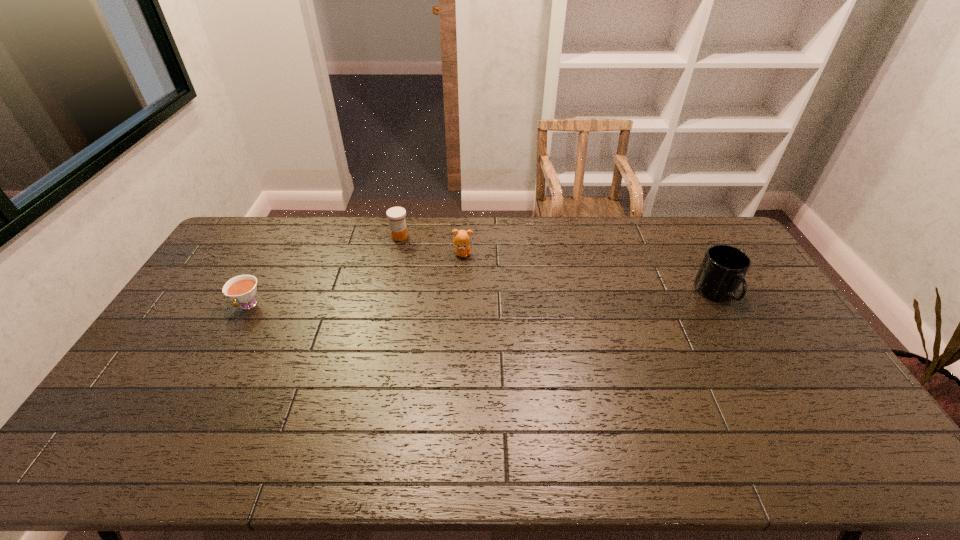
Find the location of `free space at the far edge of the desktop`. free space at the far edge of the desktop is located at coordinates (671, 235).

The width and height of the screenshot is (960, 540). I want to click on vacant space at the near edge of the desktop, so click(x=384, y=406).

Where is `free space at the left edge`? This screenshot has height=540, width=960. free space at the left edge is located at coordinates (191, 369).

The width and height of the screenshot is (960, 540). I want to click on vacant space at the right edge of the desktop, so click(x=779, y=319).

Where is `vacant area at the near left corner`? The height and width of the screenshot is (540, 960). vacant area at the near left corner is located at coordinates (149, 407).

In order to click on free space between the leftmost object and the second farthest object in this screenshot , I will do `click(355, 280)`.

The height and width of the screenshot is (540, 960). Find the location of `vacant point located between the teacup and the mug`. vacant point located between the teacup and the mug is located at coordinates (482, 300).

Where is `free space between the mug and the leftmost object`? The height and width of the screenshot is (540, 960). free space between the mug and the leftmost object is located at coordinates (482, 300).

Image resolution: width=960 pixels, height=540 pixels. Find the location of `free area in between the leftmost object and the farthest object`. free area in between the leftmost object and the farthest object is located at coordinates (324, 271).

Where is `empty space that is in between the tallest object and the third object from right to left`? The width and height of the screenshot is (960, 540). empty space that is in between the tallest object and the third object from right to left is located at coordinates (558, 265).